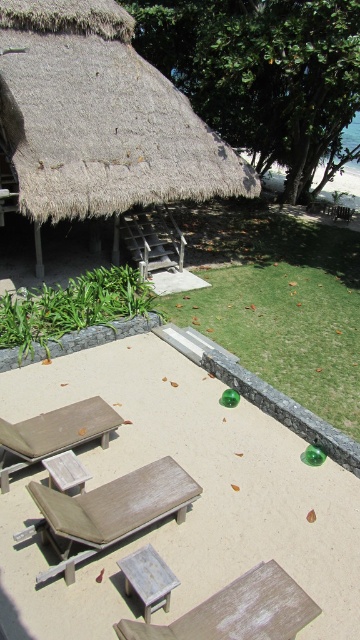
Question: Does brown wood sand at center have a lesser width compared to white weathered wood chair at center?

Choices:
 (A) no
 (B) yes

Answer: (A)

Question: Which point is closer to the camera?

Choices:
 (A) white weathered wood chair at center
 (B) thatched straw hut at upper left

Answer: (A)

Question: Does wooden lounge chair at center have a smaller size compared to white painted wood picnic table at center?

Choices:
 (A) yes
 (B) no

Answer: (B)

Question: Which point is farther from the camera taking this photo?

Choices:
 (A) (3, 470)
 (B) (135, 516)
 (C) (65, 212)

Answer: (C)

Question: Which object is the farthest from the white painted wood picnic table at center?

Choices:
 (A) white weathered wood chair at center
 (B) wooden lounge chair at center

Answer: (B)

Question: Can you confirm if wooden lounge chair at center is positioned below matte brown lounge chair at center?

Choices:
 (A) no
 (B) yes

Answer: (B)